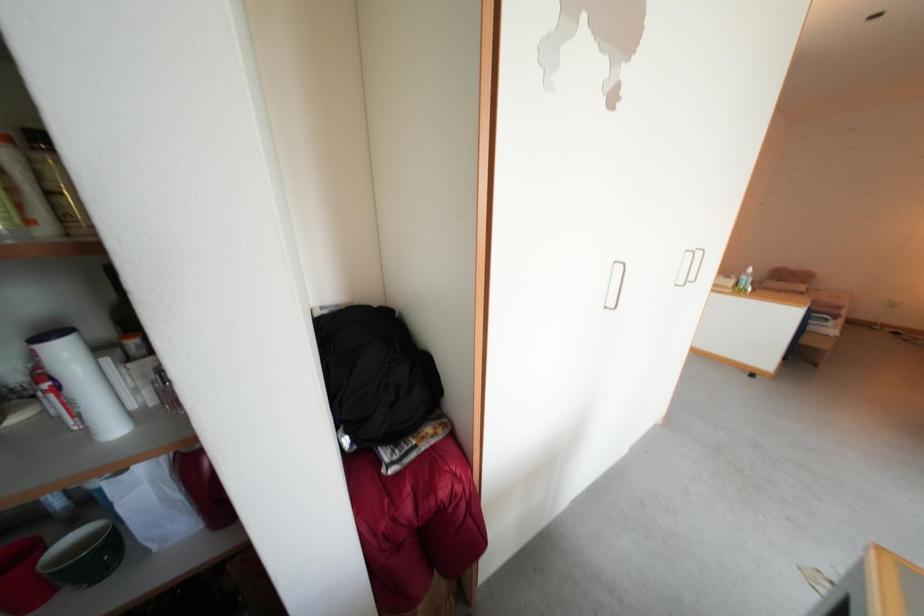
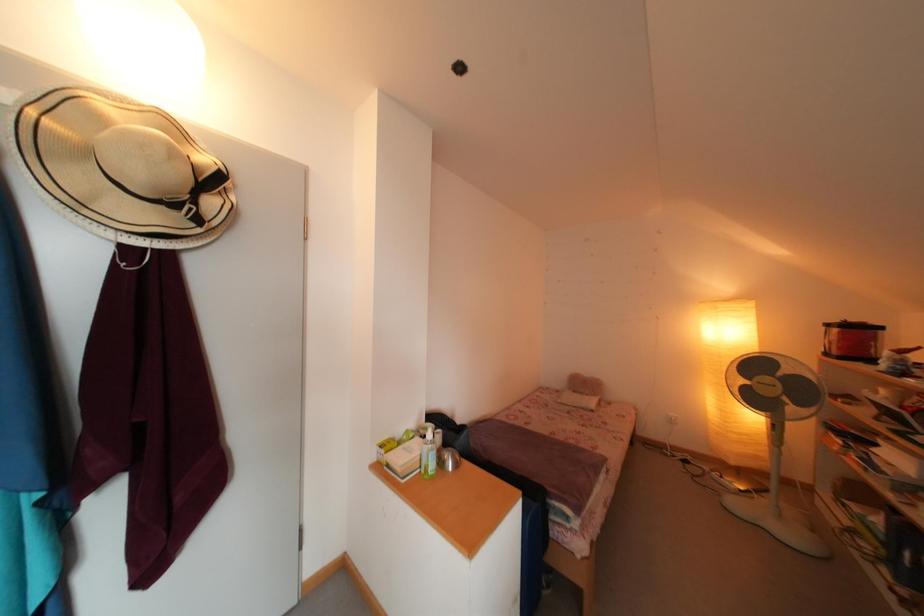
In a continuous first-person perspective shot, in which direction is the camera moving?

The movement direction of the cameraman is right, forward.